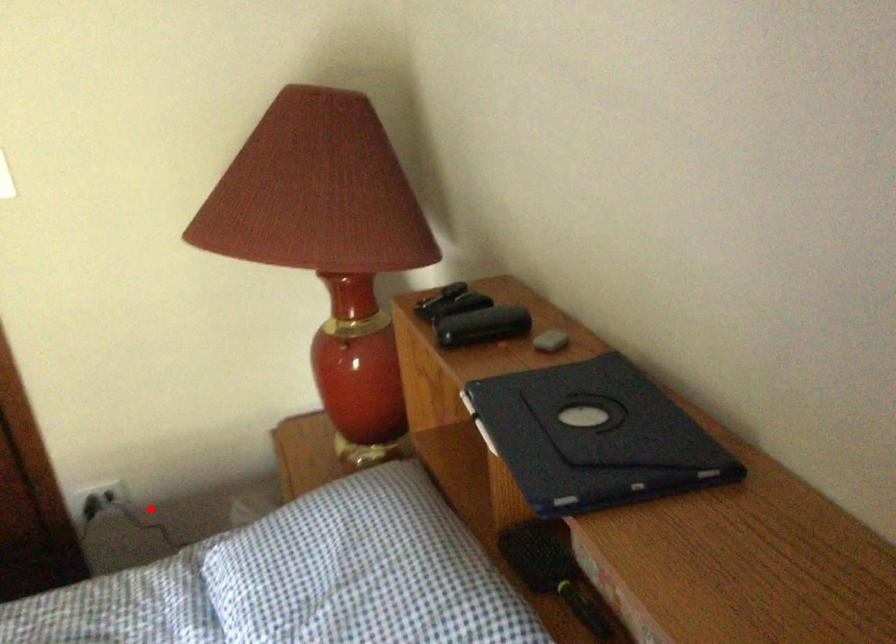
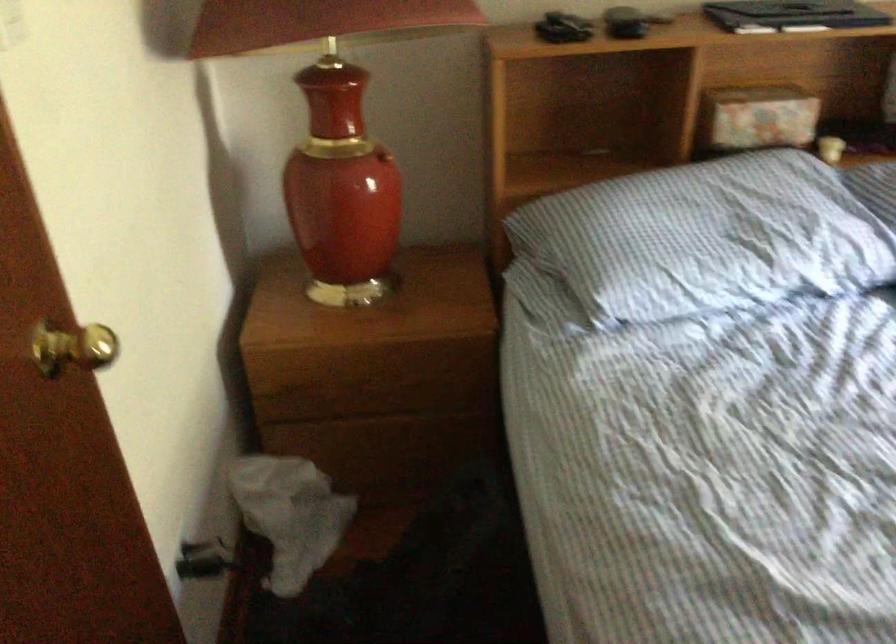
Locate, in the second image, the point that corresponds to the highlighted location in the first image.

(204, 560)